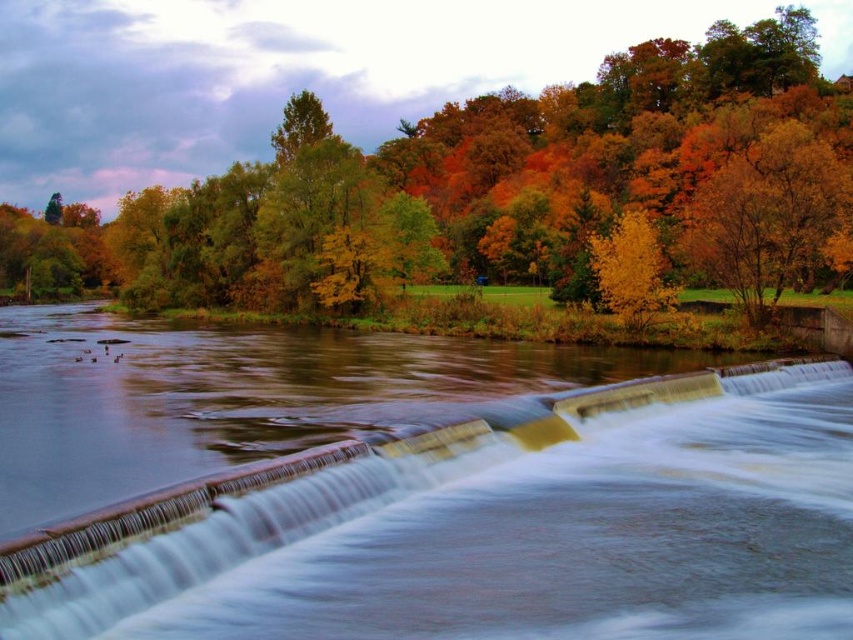
Question: Among these points, which one is nearest to the camera?

Choices:
 (A) (524, 566)
 (B) (726, 24)
 (C) (628, 214)

Answer: (A)

Question: From the image, what is the correct spatial relationship of yellow-green leaves at upper center in relation to golden yellow leaves at center right?

Choices:
 (A) left
 (B) right

Answer: (A)

Question: Is white smooth waterfall at lower center wider than golden yellow leaves at center right?

Choices:
 (A) no
 (B) yes

Answer: (B)

Question: Is yellow-green leaves at upper center closer to the viewer compared to golden yellow leaves at center right?

Choices:
 (A) yes
 (B) no

Answer: (A)

Question: Which of these objects is positioned closest to the golden yellow leaves at center right?

Choices:
 (A) white smooth waterfall at lower center
 (B) yellow-green leaves at upper center

Answer: (A)

Question: Among these points, which one is nearest to the camera?

Choices:
 (A) (572, 298)
 (B) (640, 305)

Answer: (B)